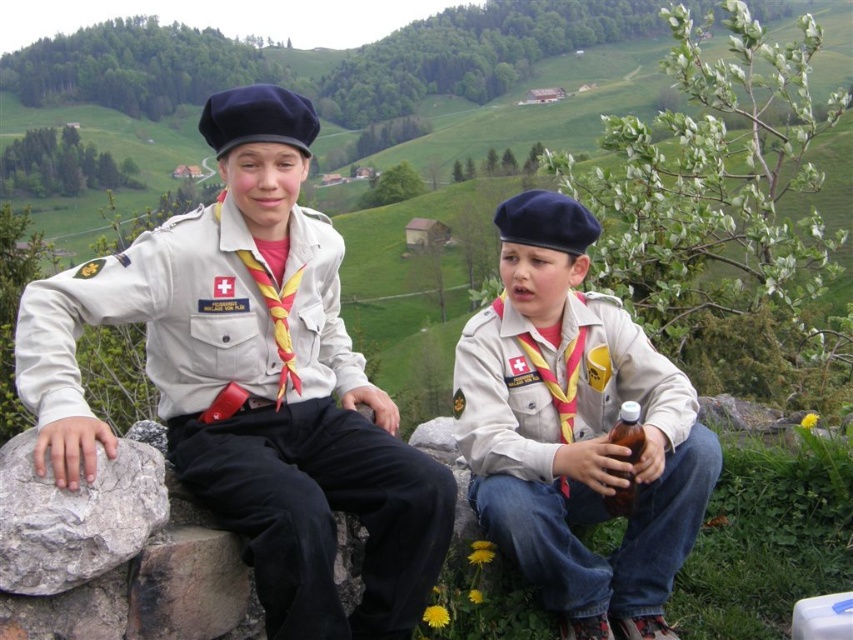
You are a photographer trying to capture both the matte khaki shirt at upper left and the brown glass bottle at lower right in a single frame. Given their sizes, which object should you focus on to ensure both fit clearly in the photo?

Since the matte khaki shirt at upper left is bigger than the brown glass bottle at lower right, you should focus on the matte khaki shirt at upper left to ensure both objects fit clearly in the photo.

You are a hiker who needs to place a small first aid kit. You have the gray rough rock at left and the brown glass bottle at lower right. Which object can you place the first aid kit on top of?

The gray rough rock at left has a larger size compared to the brown glass bottle at lower right, so the first aid kit can be placed on top of the gray rough rock at left.

You are a hiker who needs to place a small item on a surface that is closer to you. Which object should you choose between the gray rough rock at left and the brown glass bottle at lower right?

The gray rough rock at left is in front of the brown glass bottle at lower right, so it is closer to you. You should choose the gray rough rock at left to place your small item.